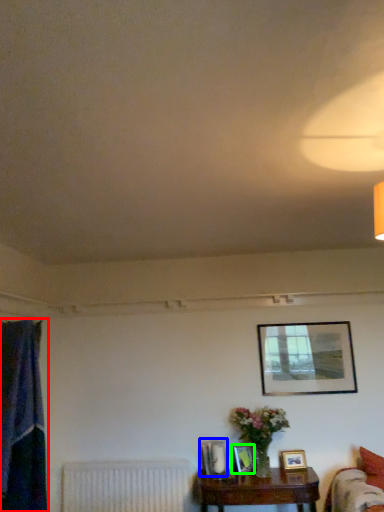
Question: Considering the real-world distances, which object is closest to curtain (highlighted by a red box)? picture frame (highlighted by a blue box) or picture frame (highlighted by a green box).

Choices:
 (A) picture frame
 (B) picture frame

Answer: (A)